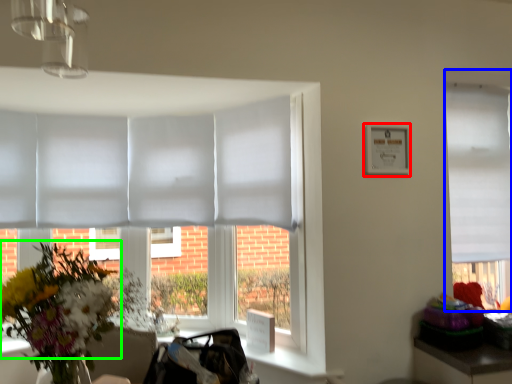
Question: Based on their relative distances, which object is nearer to picture frame (highlighted by a red box)? Choose from window (highlighted by a blue box) and flower (highlighted by a green box).

Choices:
 (A) window
 (B) flower

Answer: (A)